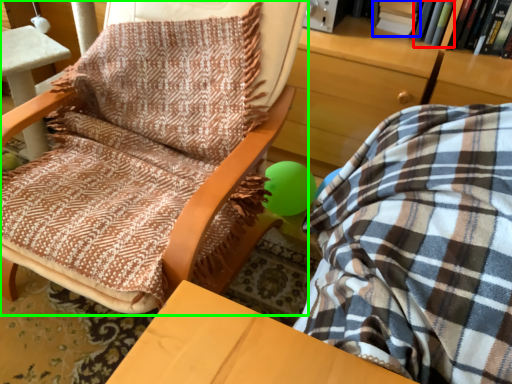
Question: Estimate the real-world distances between objects in this image. Which object is closer to book (highlighted by a red box), book (highlighted by a blue box) or chair (highlighted by a green box)?

Choices:
 (A) book
 (B) chair

Answer: (A)